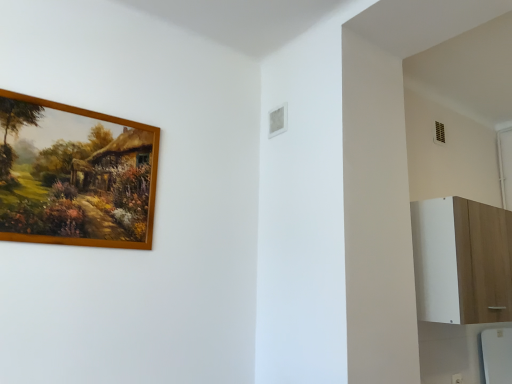
Question: Could you tell me if wooden picture frame at upper left is facing white wood cabinet at right?

Choices:
 (A) yes
 (B) no

Answer: (B)

Question: From the image's perspective, is wooden picture frame at upper left on top of white wood cabinet at right?

Choices:
 (A) no
 (B) yes

Answer: (B)

Question: From a real-world perspective, is wooden picture frame at upper left beneath white wood cabinet at right?

Choices:
 (A) no
 (B) yes

Answer: (A)

Question: Is wooden picture frame at upper left wider than white wood cabinet at right?

Choices:
 (A) no
 (B) yes

Answer: (A)

Question: Does wooden picture frame at upper left appear on the left side of white wood cabinet at right?

Choices:
 (A) no
 (B) yes

Answer: (B)

Question: Is wooden picture frame at upper left smaller than white wood cabinet at right?

Choices:
 (A) no
 (B) yes

Answer: (B)

Question: Could wooden picture frame at upper left be considered to be inside white wood cabinet at right?

Choices:
 (A) no
 (B) yes

Answer: (A)

Question: From the image's perspective, is white wood cabinet at right beneath wooden picture frame at upper left?

Choices:
 (A) no
 (B) yes

Answer: (B)

Question: Is white wood cabinet at right turned away from wooden picture frame at upper left?

Choices:
 (A) no
 (B) yes

Answer: (A)

Question: Is white wood cabinet at right next to wooden picture frame at upper left?

Choices:
 (A) no
 (B) yes

Answer: (A)

Question: Does white wood cabinet at right appear on the left side of wooden picture frame at upper left?

Choices:
 (A) yes
 (B) no

Answer: (B)

Question: From a real-world perspective, is white wood cabinet at right located higher than wooden picture frame at upper left?

Choices:
 (A) no
 (B) yes

Answer: (A)

Question: Considering their positions, is white wood cabinet at right located in front of or behind wooden picture frame at upper left?

Choices:
 (A) behind
 (B) front

Answer: (A)